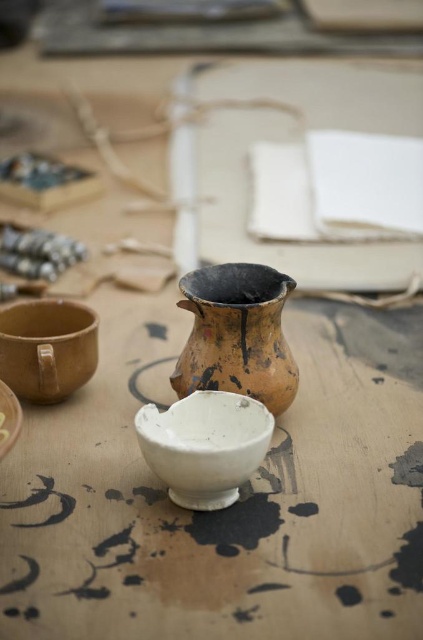
Question: Is white glossy bowl at center positioned in front of matte brown bowl at lower left?

Choices:
 (A) no
 (B) yes

Answer: (B)

Question: Which point is closer to the camera?

Choices:
 (A) (242, 291)
 (B) (65, 349)
 (C) (0, 388)
 (D) (228, 502)

Answer: (D)

Question: Which object appears closest to the camera in this image?

Choices:
 (A) white matte bowl at center
 (B) white glossy bowl at center

Answer: (A)

Question: Where is brown earthenware jug at center located in relation to white matte bowl at center in the image?

Choices:
 (A) above
 (B) below

Answer: (A)

Question: Is matte brown bowl at lower left closer to camera compared to white matte bowl at center?

Choices:
 (A) no
 (B) yes

Answer: (A)

Question: Which object is positioned closest to the white matte bowl at center?

Choices:
 (A) brown earthenware jug at center
 (B) matte brown bowl at lower left

Answer: (B)